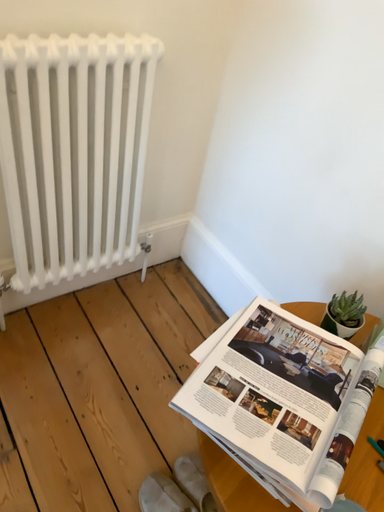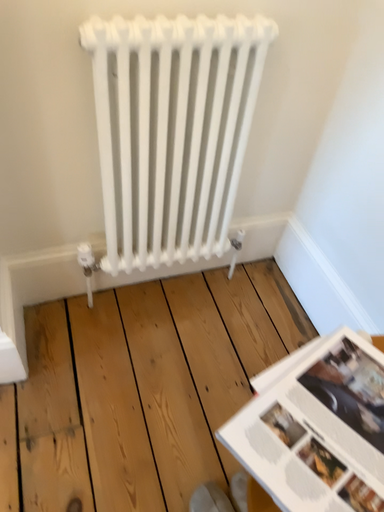
Question: Which way did the camera rotate in the video?

Choices:
 (A) rotated left
 (B) rotated right

Answer: (A)